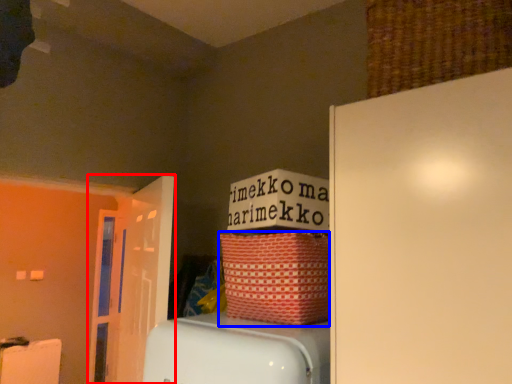
Question: Which object appears closest to the camera in this image, door (highlighted by a red box) or basket (highlighted by a blue box)?

Choices:
 (A) door
 (B) basket

Answer: (B)